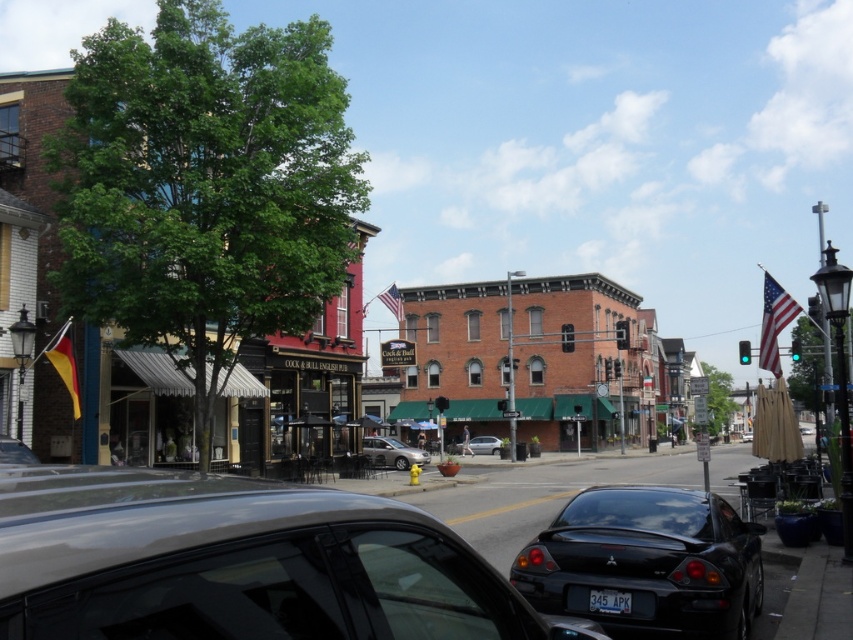
You are a delivery person needing to park your vehicle in a tight space between the two cars in the image. The space between them is 4 meters. Your delivery van is 3.5 meters long. Can you safely park your van between the glossy black car at center and the satin silver sedan at center?

The glossy black car at center is larger in size than the satin silver sedan at center, but the total space between them is 4 meters. Since your van is 3.5 meters long, there is enough space to park as long as the combined length of both cars does not exceed the available space. However, without knowing the exact lengths of each car, it is difficult to confirm. The description only states the black car is larger, but not by how much. Therefore, it might be risky to assume sufficient space without more data.

You are a pedestrian standing at the crosswalk observing the vehicles in the street. Which car, the glossy black car at center or the silver metallic sedan at center, is closer to you?

The glossy black car at center is closer to you because it is positioned in front of the silver metallic sedan at center.

You are a delivery driver who needs to park your truck between the two cars in the image. The truck is 2.5 meters wide. Can you fit your truck between the glossy black car at center and the satin silver sedan at center?

The glossy black car at center is wider than the satin silver sedan at center. However, the total width between them isn not specified. Without knowing the distance between the cars, it is impossible to determine if the truck can fit.